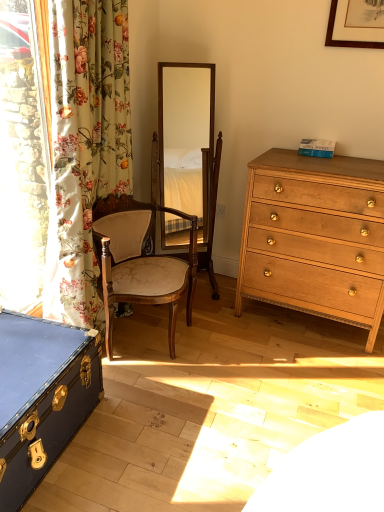
The image size is (384, 512). I want to click on unoccupied region to the right of wooden upholstered chair at center, so click(x=226, y=335).